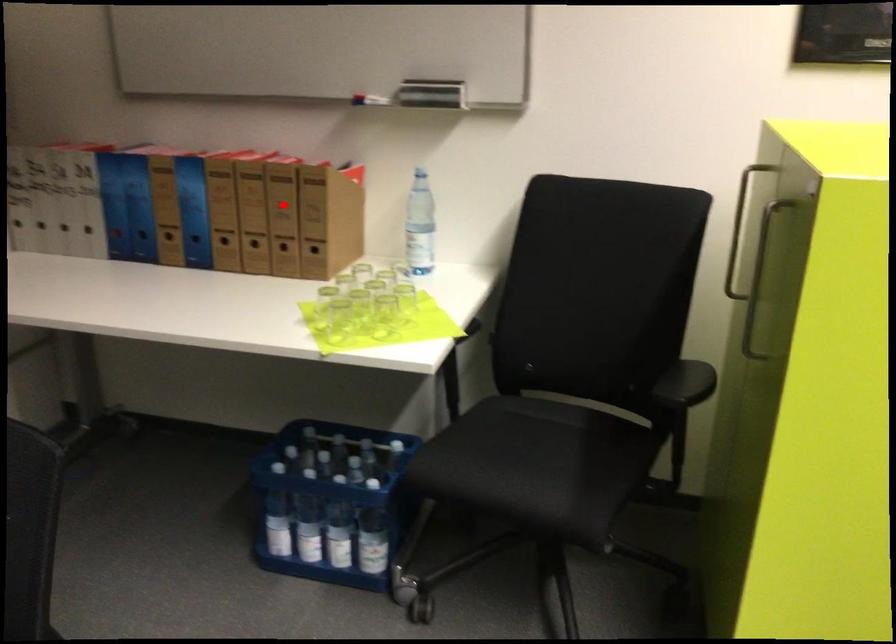
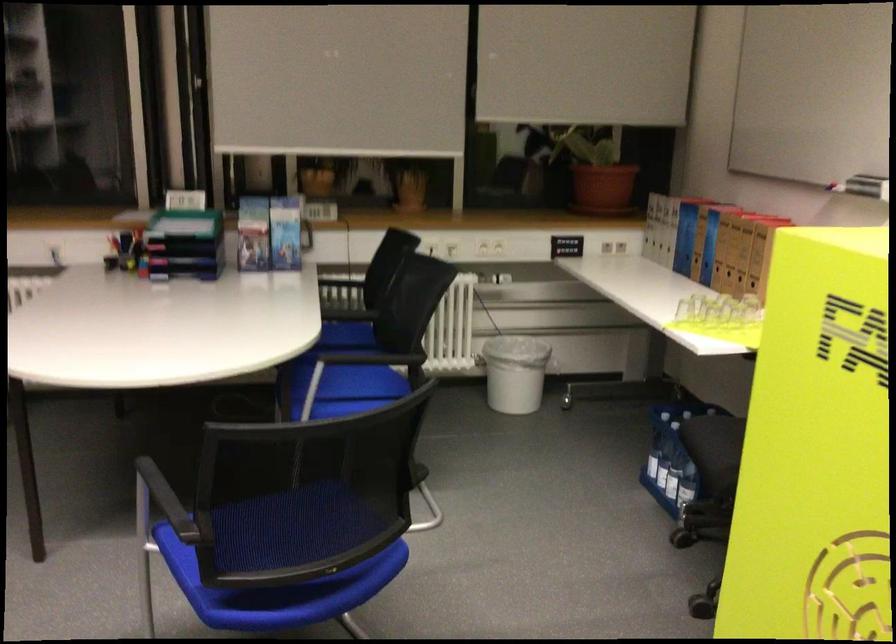
Locate, in the second image, the point that corresponds to the highlighted location in the first image.

(746, 243)